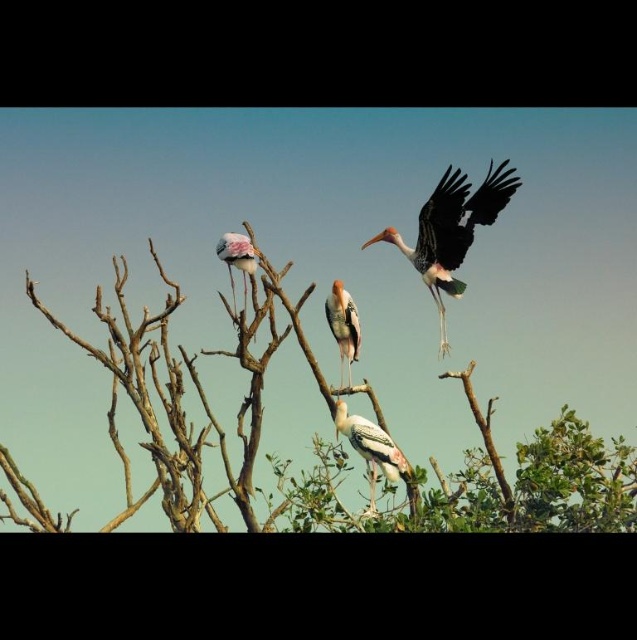
Question: Is multicolored feathered bird at upper right to the left of speckled feathered bird at center from the viewer's perspective?

Choices:
 (A) yes
 (B) no

Answer: (B)

Question: Which object is positioned closest to the green leafy tree at upper center?

Choices:
 (A) multicolored feathered bird at upper right
 (B) painted wood stork at center

Answer: (B)

Question: Which object appears closest to the camera in this image?

Choices:
 (A) painted wood stork at center
 (B) speckled feathered bird at center
 (C) multicolored feathered bird at upper right

Answer: (B)

Question: Which is farther from the multicolored feathered bird at upper right?

Choices:
 (A) painted wood stork at center
 (B) speckled feathered bird at center
 (C) white feathered bird at upper center

Answer: (B)

Question: Can you confirm if green leafy tree at upper center is positioned to the left of multicolored feathered bird at upper right?

Choices:
 (A) no
 (B) yes

Answer: (B)

Question: Is multicolored feathered bird at upper right further to the viewer compared to painted wood stork at center?

Choices:
 (A) yes
 (B) no

Answer: (B)